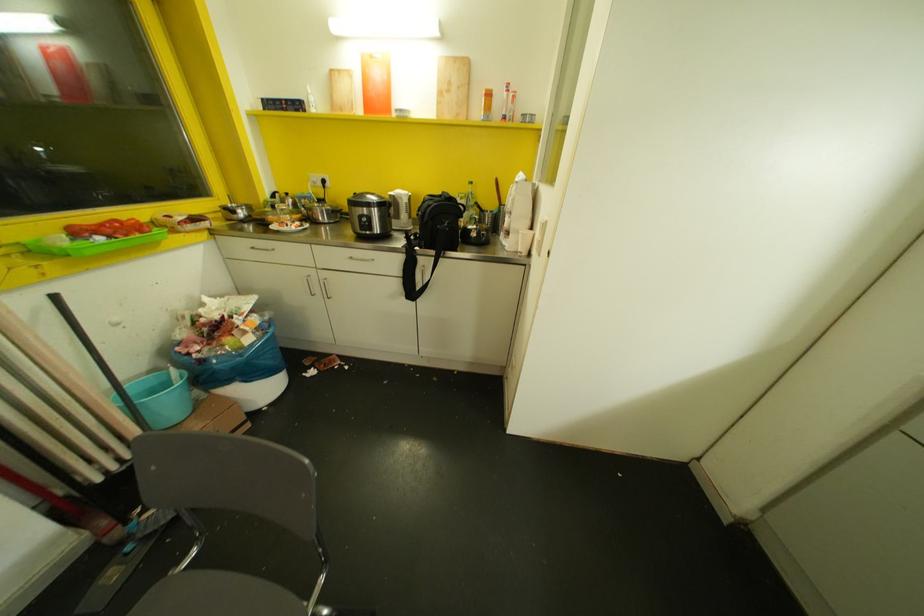
This screenshot has height=616, width=924. In order to click on white kettle handle in this screenshot , I will do [x=398, y=204].